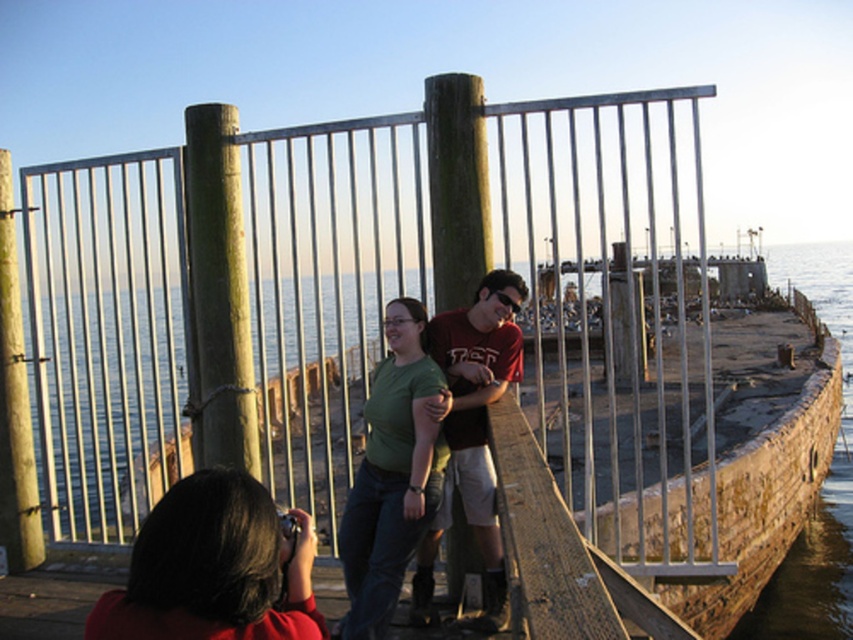
Question: Does green matte shirt at center appear under matte red t-shirt at center?

Choices:
 (A) no
 (B) yes

Answer: (B)

Question: Is the position of green matte shirt at center less distant than that of matte red t-shirt at center?

Choices:
 (A) no
 (B) yes

Answer: (B)

Question: Among these points, which one is farthest from the camera?

Choices:
 (A) (621, 518)
 (B) (500, 600)
 (C) (345, 579)
 (D) (193, 525)

Answer: (A)

Question: Which point is closer to the camera?

Choices:
 (A) matte black camera at lower left
 (B) green matte shirt at center
 (C) matte red t-shirt at center
 (D) metallic gate at center

Answer: (A)

Question: Is metallic gate at center wider than green matte shirt at center?

Choices:
 (A) no
 (B) yes

Answer: (B)

Question: Which point is closer to the camera taking this photo?

Choices:
 (A) (367, 502)
 (B) (242, 608)

Answer: (B)